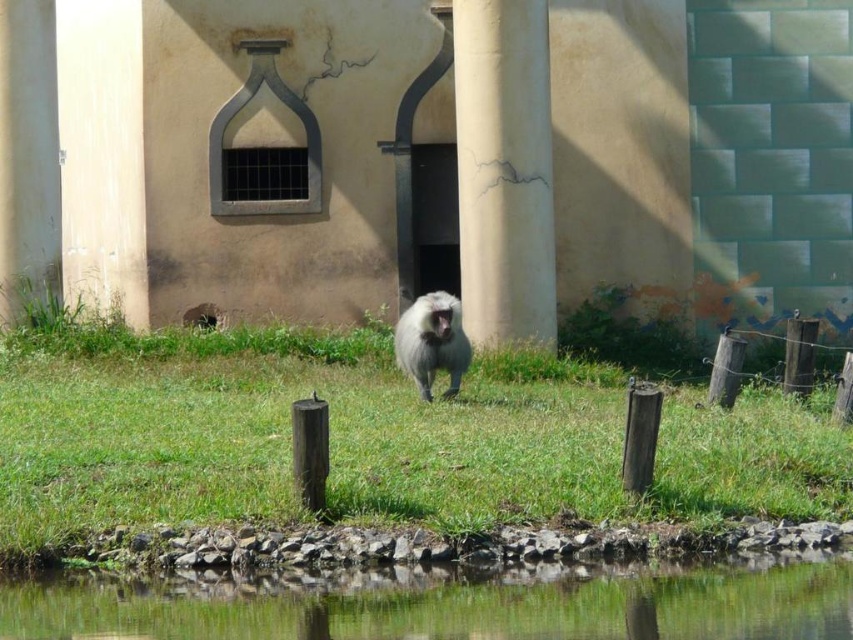
Question: Can you confirm if clear water at lower center is positioned to the left of smooth concrete pillar at center?

Choices:
 (A) no
 (B) yes

Answer: (B)

Question: Does clear water at lower center appear on the left side of smooth concrete pillar at center?

Choices:
 (A) yes
 (B) no

Answer: (A)

Question: Among these objects, which one is nearest to the camera?

Choices:
 (A) smooth concrete pillar at center
 (B) green grass at center
 (C) clear water at lower center
 (D) fuzzy gray monkey at center

Answer: (C)

Question: Which of the following is the farthest from the observer?

Choices:
 (A) clear water at lower center
 (B) smooth concrete pillar at center
 (C) fuzzy gray monkey at center

Answer: (B)

Question: Estimate the real-world distances between objects in this image. Which object is closer to the smooth concrete pillar at center?

Choices:
 (A) clear water at lower center
 (B) fuzzy gray monkey at center

Answer: (B)

Question: Can you confirm if green grass at center is positioned to the left of clear water at lower center?

Choices:
 (A) no
 (B) yes

Answer: (B)